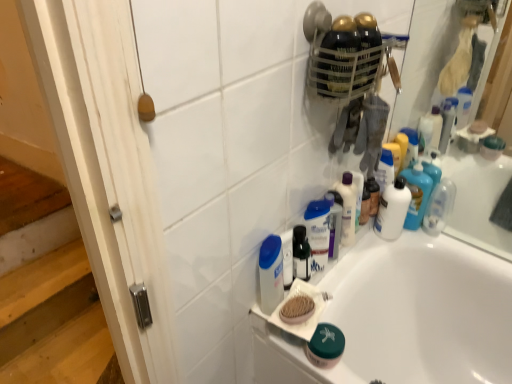
The width and height of the screenshot is (512, 384). Find the location of `unoccupied area in front of clear plastic bottle at upper right, which is the 4th toiletry from left to right`. unoccupied area in front of clear plastic bottle at upper right, which is the 4th toiletry from left to right is located at coordinates (463, 250).